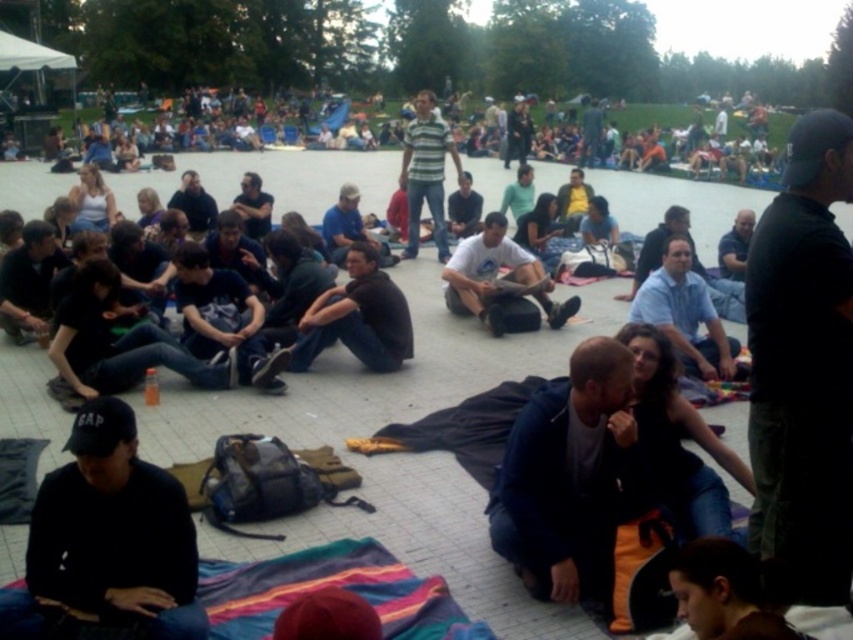
You are standing at the center of the gathering area and want to take a photo that includes both the point at coordinates point (x=321, y=300) and point (x=457, y=282). Which point will appear larger in the photo?

Point (x=321, y=300) is closer to the camera than point (x=457, y=282), so it will appear larger in the photo.

You are standing at the edge of the gathering and want to walk towards the two points marked in the image. Which point, point (550,586) or point (525,260), will you reach first?

You will reach point (550,586) first because it is closer to you than point (525,260).